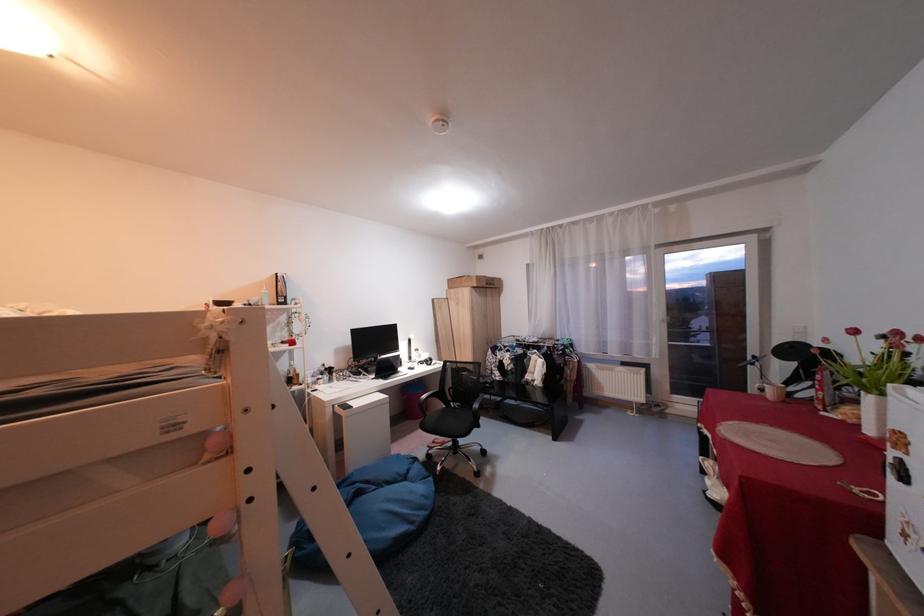
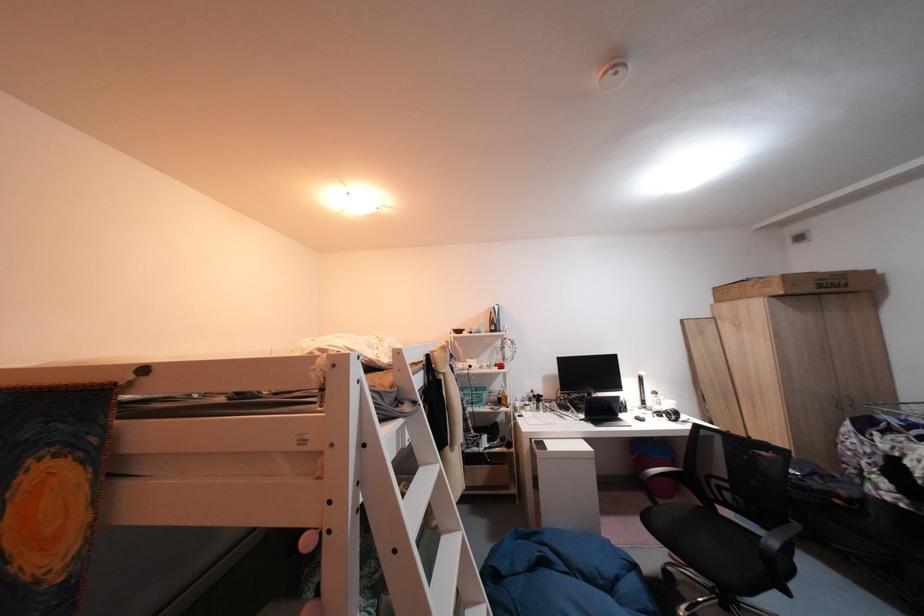
Locate, in the second image, the point that corresponds to (488,278) in the first image.

(794, 278)